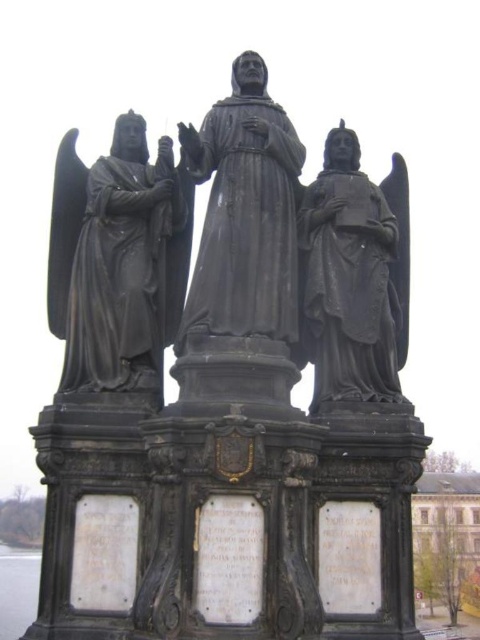
Measure the distance between black stone statue at center and matte black statue at right.

black stone statue at center and matte black statue at right are 6.95 meters apart from each other.

Does black stone statue at center appear on the right side of matte black statue at right?

No, black stone statue at center is not to the right of matte black statue at right.

Is point (288, 292) farther from viewer compared to point (356, 161)?

No, (288, 292) is closer to viewer.

Locate an element on the screen. The height and width of the screenshot is (640, 480). black stone statue at center is located at coordinates (244, 212).

Can you confirm if black polished statue at left is wider than matte black statue at right?

Yes.

Between black polished statue at left and matte black statue at right, which one is positioned higher?

black polished statue at left

Who is more forward, (130, 266) or (370, 326)?

Point (370, 326) is in front.

This screenshot has width=480, height=640. In order to click on black polished statue at left in this screenshot , I will do `click(118, 257)`.

Is black polished statue at left to the left of black stone statue at center from the viewer's perspective?

Indeed, black polished statue at left is positioned on the left side of black stone statue at center.

Who is lower down, black polished statue at left or black stone statue at center?

black polished statue at left is below.

The height and width of the screenshot is (640, 480). Identify the location of black polished statue at left. (118, 257).

Where is `black polished statue at left`? The width and height of the screenshot is (480, 640). black polished statue at left is located at coordinates (118, 257).